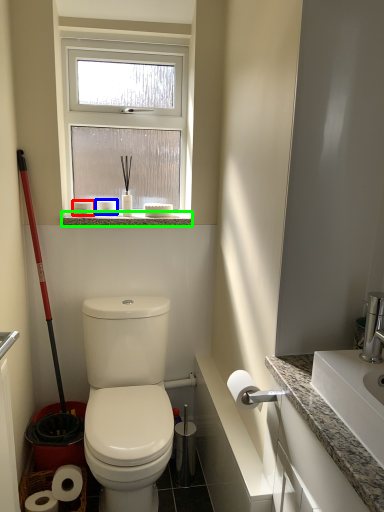
Question: Which is farther away from toilet paper (highlighted by a red box)? toilet paper (highlighted by a blue box) or window sill (highlighted by a green box)?

Choices:
 (A) toilet paper
 (B) window sill

Answer: (B)